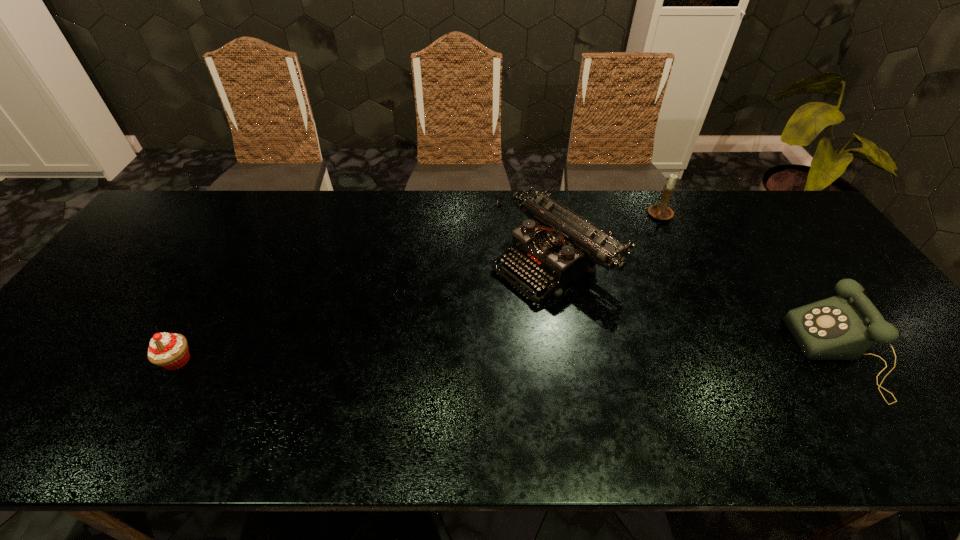
The image size is (960, 540). What are the coordinates of `free space between the candle holder and the rightmost object` in the screenshot? It's located at (750, 285).

Image resolution: width=960 pixels, height=540 pixels. I want to click on empty space that is in between the leftmost object and the second object from left to right, so click(366, 311).

Locate an element on the screen. Image resolution: width=960 pixels, height=540 pixels. free spot between the shortest object and the third tallest object is located at coordinates (509, 357).

Locate which object ranks third in proximity to the rightmost object. Please provide its 2D coordinates. Your answer should be formatted as a tuple, i.e. [(x, y)], where the tuple contains the x and y coordinates of a point satisfying the conditions above.

[(168, 350)]

Where is `object that ranks as the closest to the rightmost object`? The height and width of the screenshot is (540, 960). object that ranks as the closest to the rightmost object is located at coordinates (556, 246).

Where is `vacant point that satisfies the following two spatial constraints: 1. on the back side of the candle holder; 2. on the right side of the typewriter`? vacant point that satisfies the following two spatial constraints: 1. on the back side of the candle holder; 2. on the right side of the typewriter is located at coordinates (546, 216).

At what (x,y) coordinates should I click in order to perform the action: click on free space in the image that satisfies the following two spatial constraints: 1. on the back side of the leftmost object; 2. on the dial of the second shortest object. Please return your answer as a coordinate pair (x, y). Looking at the image, I should click on (180, 354).

Find the location of a particular element. This screenshot has width=960, height=540. vacant space that satisfies the following two spatial constraints: 1. on the front side of the rightmost object; 2. on the dial of the typewriter is located at coordinates (569, 354).

The height and width of the screenshot is (540, 960). What are the coordinates of `free space in the image that satisfies the following two spatial constraints: 1. on the front side of the telephone; 2. on the dial of the third object from left to right` in the screenshot? It's located at (724, 354).

Locate an element on the screen. Image resolution: width=960 pixels, height=540 pixels. free location that satisfies the following two spatial constraints: 1. on the front side of the typewriter; 2. on the dial of the rightmost object is located at coordinates (569, 354).